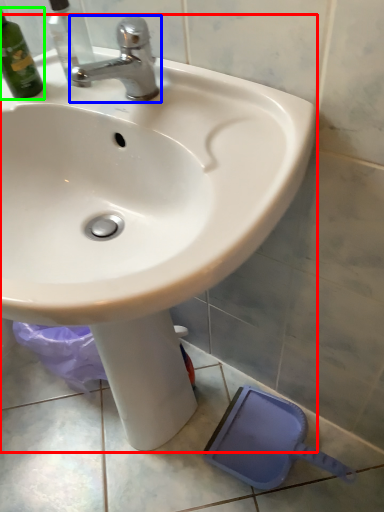
Question: Estimate the real-world distances between objects in this image. Which object is closer to sink (highlighted by a red box), tap (highlighted by a blue box) or bottle (highlighted by a green box)?

Choices:
 (A) tap
 (B) bottle

Answer: (A)